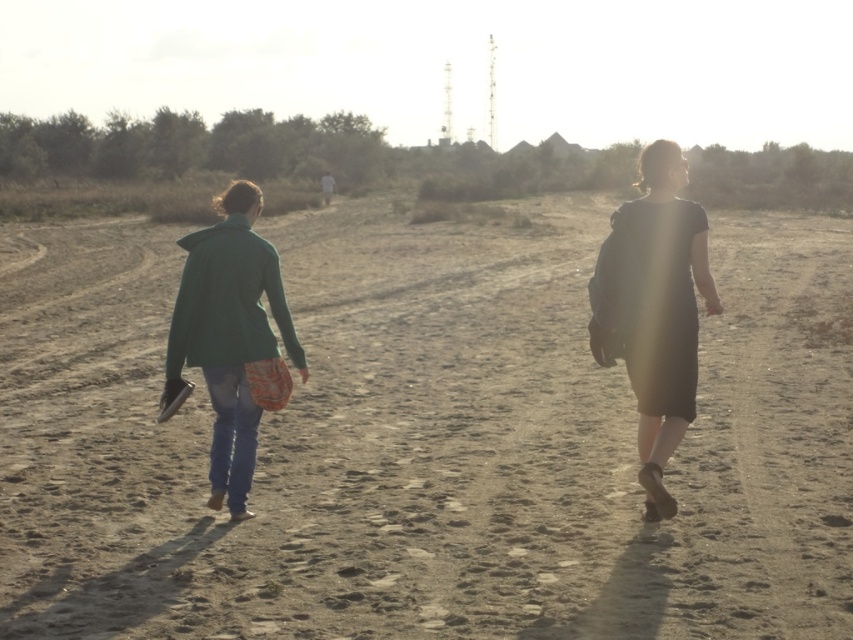
Question: Which object is positioned farthest from the green fabric jacket at left?

Choices:
 (A) matte black dress at right
 (B) green matte jacket at left
 (C) brown sandy dirt at center

Answer: (C)

Question: Does green fabric jacket at left lie behind matte black dress at right?

Choices:
 (A) yes
 (B) no

Answer: (A)

Question: Which of these objects is positioned closest to the green matte jacket at left?

Choices:
 (A) matte black dress at right
 (B) brown sandy dirt at center

Answer: (A)

Question: Where is brown sandy dirt at center located in relation to matte black dress at right in the image?

Choices:
 (A) right
 (B) left

Answer: (A)

Question: Observing the image, what is the correct spatial positioning of brown sandy dirt at center in reference to green fabric jacket at left?

Choices:
 (A) below
 (B) above

Answer: (B)

Question: Which point appears closest to the camera in this image?

Choices:
 (A) (656, 333)
 (B) (277, 321)
 (C) (590, 413)

Answer: (A)